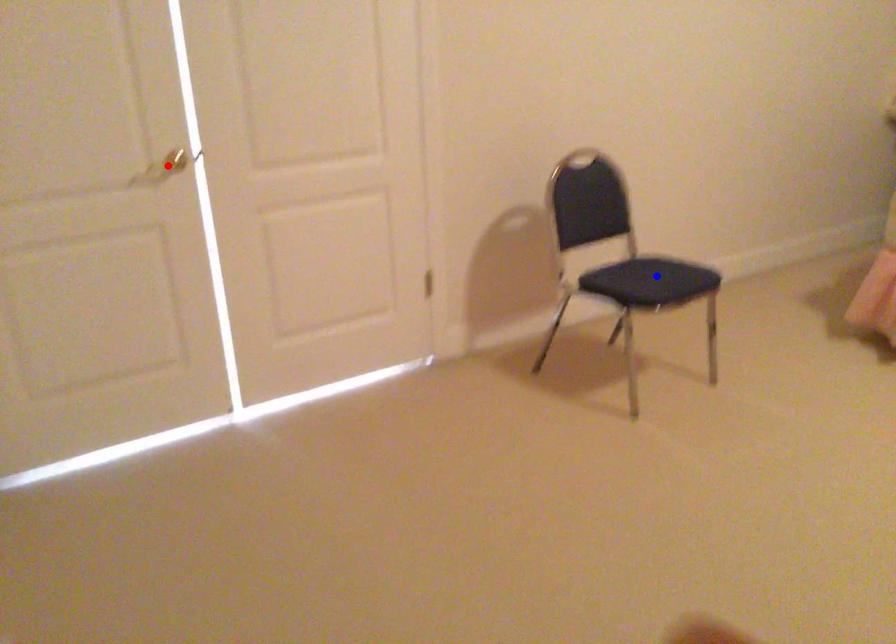
Question: Two points are marked on the image. Which point is closer to the camera?

Choices:
 (A) Blue point is closer.
 (B) Red point is closer.

Answer: (B)